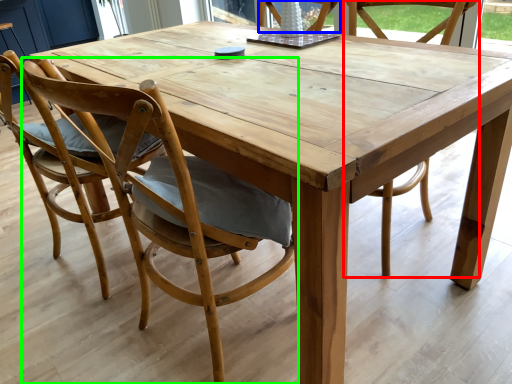
Question: Which object is positioned farthest from chair (highlighted by a red box)? Select from chair (highlighted by a blue box) and chair (highlighted by a green box).

Choices:
 (A) chair
 (B) chair

Answer: (B)